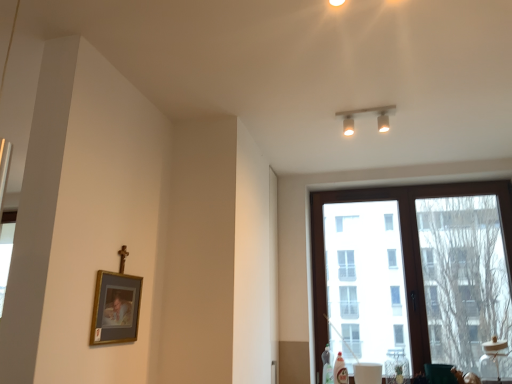
Question: Considering the positions of point (313, 326) and point (379, 120), is point (313, 326) closer or farther from the camera than point (379, 120)?

Choices:
 (A) closer
 (B) farther

Answer: (B)

Question: In the image, is brown wooden window at right positioned in front of or behind matte white track lights at upper center?

Choices:
 (A) behind
 (B) front

Answer: (A)

Question: Which object is the farthest from the brown wooden window at right?

Choices:
 (A) matte white track lights at upper center
 (B) gold-framed picture at lower left

Answer: (B)

Question: Which is farther from the matte white track lights at upper center?

Choices:
 (A) gold-framed picture at lower left
 (B) brown wooden window at right

Answer: (A)